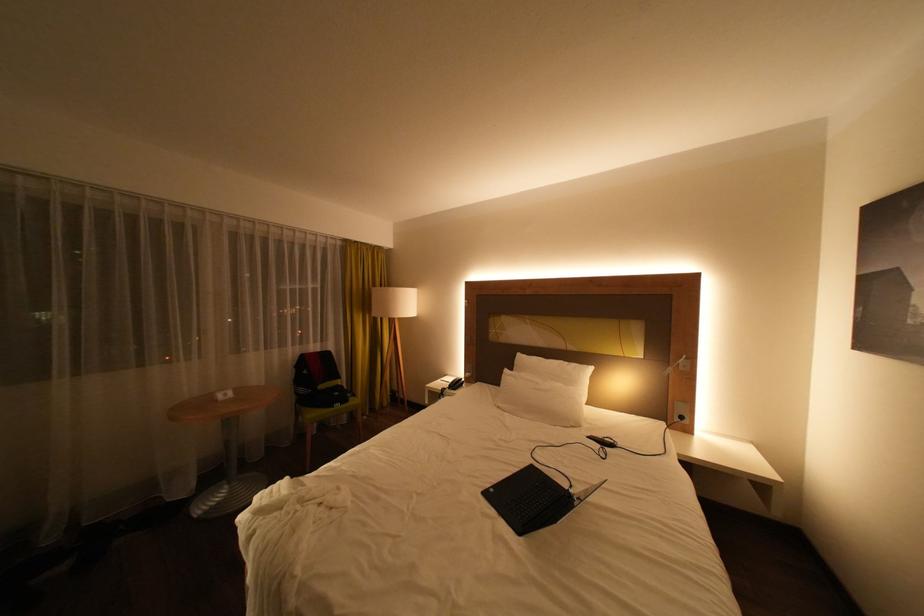
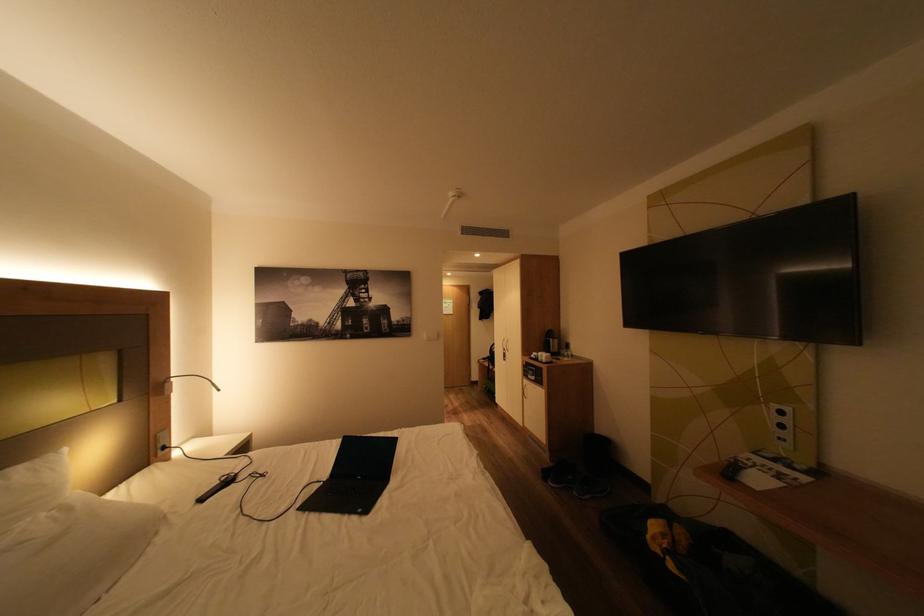
Locate, in the second image, the point that corresponds to pixel 581 487 in the first image.

(329, 483)